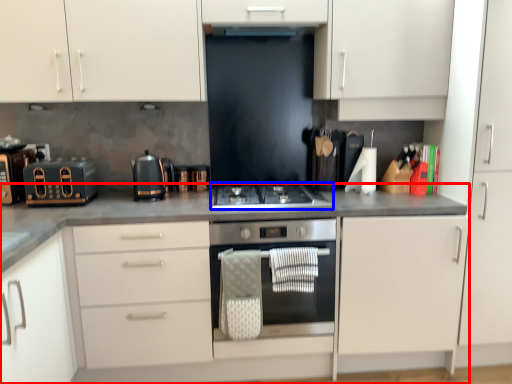
Question: Which point is closer to the camera, countertop (highlighted by a red box) or gas stove (highlighted by a blue box)?

Choices:
 (A) countertop
 (B) gas stove

Answer: (A)